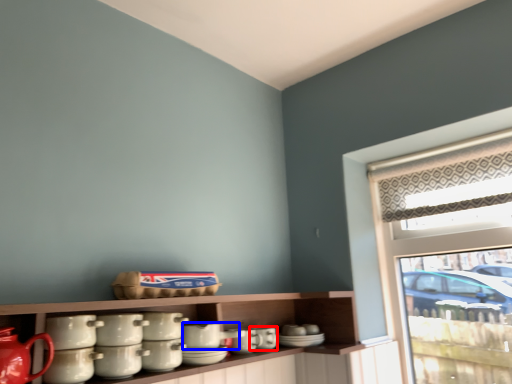
Question: Which object is further to the camera taking this photo, tableware (highlighted by a red box) or tableware (highlighted by a blue box)?

Choices:
 (A) tableware
 (B) tableware

Answer: (A)